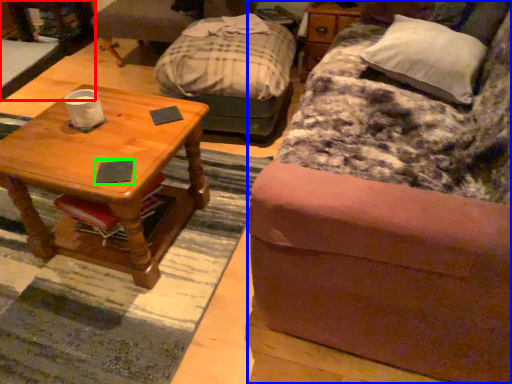
Question: Which object is positioned closest to desk (highlighted by a red box)? Select from studio couch (highlighted by a blue box) and pad (highlighted by a green box).

Choices:
 (A) studio couch
 (B) pad

Answer: (B)